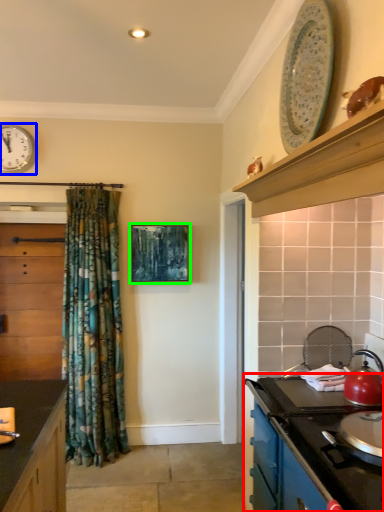
Question: Which object is positioned farthest from cabinetry (highlighted by a red box)? Select from clock (highlighted by a blue box) and picture frame (highlighted by a green box).

Choices:
 (A) clock
 (B) picture frame

Answer: (A)